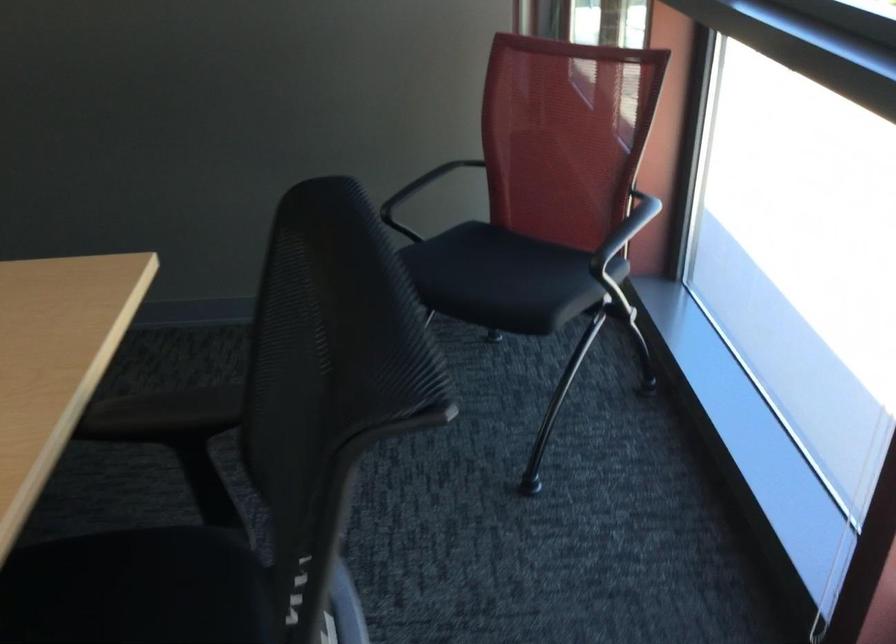
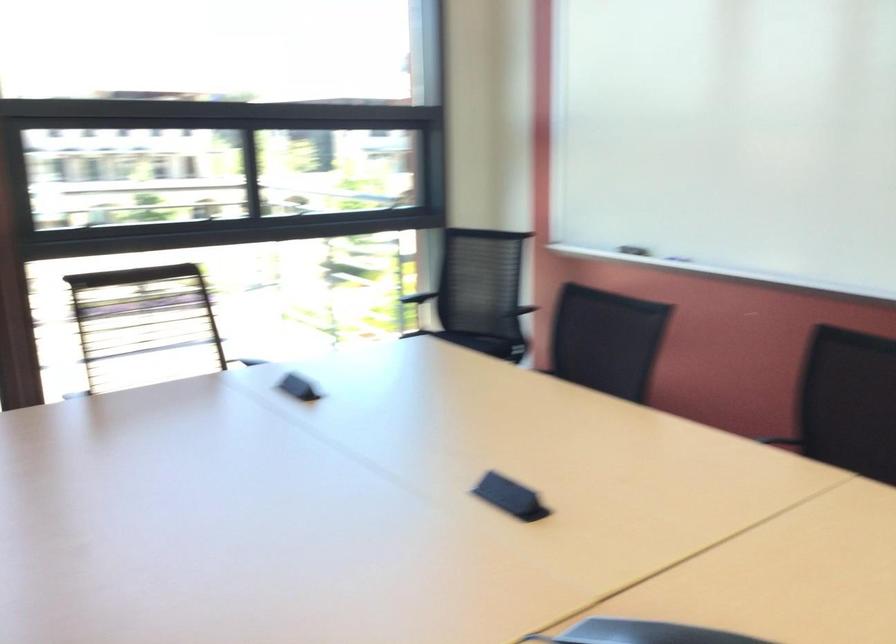
Question: I am providing you with two images of the same scene from different viewpoints. Which of the following objects are not visible in image2?

Choices:
 (A) black chair armrest
 (B) whiteboard eraser
 (C) light blue scale
 (D) blind pull cord

Answer: (D)